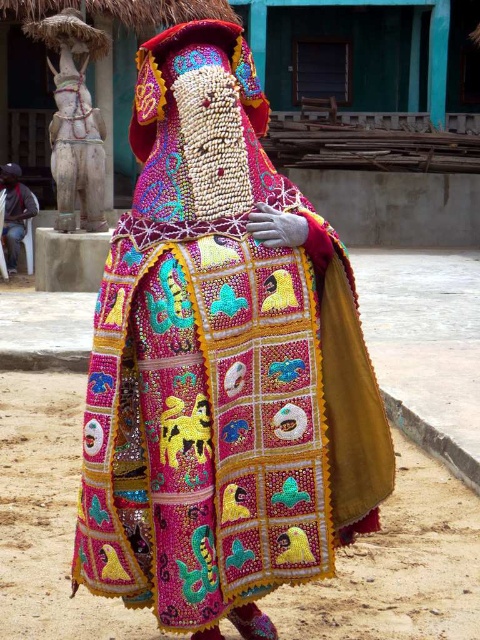
Between beaded fabric costume at center and black fabric at lower left, which one appears on the right side from the viewer's perspective?

From the viewer's perspective, beaded fabric costume at center appears more on the right side.

The image size is (480, 640). Describe the element at coordinates (222, 364) in the screenshot. I see `beaded fabric costume at center` at that location.

The height and width of the screenshot is (640, 480). Find the location of `beaded fabric costume at center`. beaded fabric costume at center is located at coordinates (222, 364).